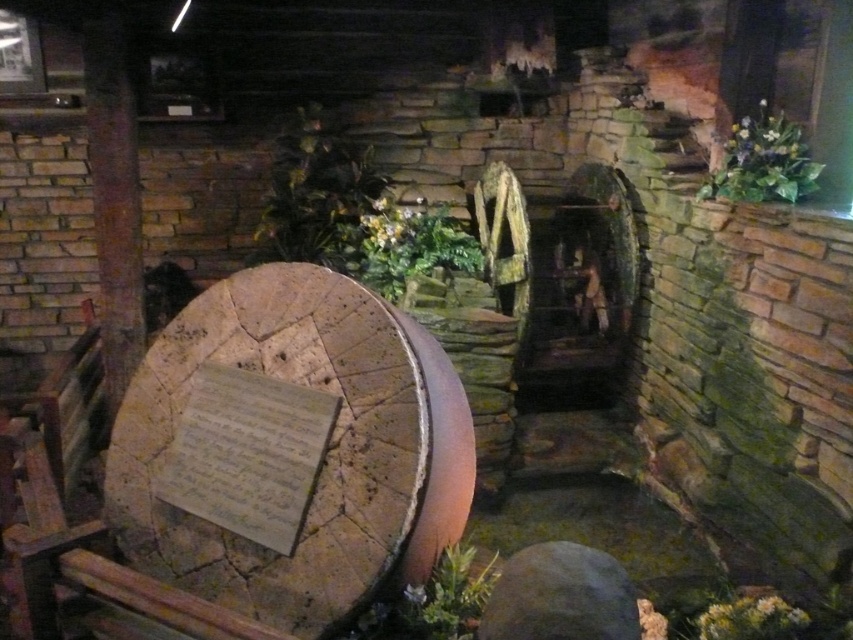
You are a gardener who needs to water two green leafy plants. The first is the green leafy plant at upper center and the second is the green leafy plant at lower center. You have a watering can that holds enough water for one plant. After watering the first plant, can you walk to the second plant without needing to refill your watering can? Assume you walk at a normal pace and the distance between the plants is as described.

The distance between the green leafy plant at upper center and the green leafy plant at lower center is 8.82 feet. Since the watering can holds enough water for one plant, you would need to refill it before moving to the second plant. However, the distance is short enough that you might not need to refill unless the watering can depletes quickly during the walk. But based on the given information, the watering can only holds enough for one plant, so you should refill before proceeding.

You are standing at the entrance of the museum exhibit and want to locate the green leafy plant at lower center. Which coordinate point should you look towards?

The green leafy plant at lower center is located at coordinate point (x=434, y=602).

Consider the image. You are standing in the museum and want to take a photo of the millstone and the waterwheel. The camera you have can only focus on objects within 5 meters. Is the point at coordinates point [404,208] within the camera focus range?

The distance of point [404,208] from viewer is 5.04 meters, which is slightly beyond the camera focus range of 5 meters. Therefore, the point is out of focus range.